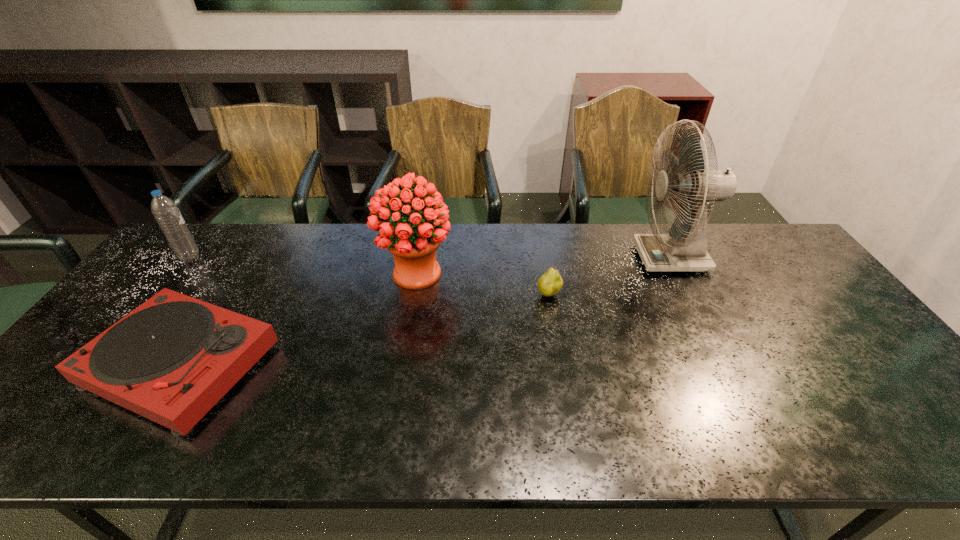
The width and height of the screenshot is (960, 540). What are the coordinates of `object situated at the far left corner` in the screenshot? It's located at (165, 211).

Locate an element on the screen. The height and width of the screenshot is (540, 960). object present at the near left corner is located at coordinates (170, 360).

Image resolution: width=960 pixels, height=540 pixels. Find the location of `free point at the far edge`. free point at the far edge is located at coordinates (526, 245).

You are a GUI agent. You are given a task and a screenshot of the screen. Output one action in this format:
    pyautogui.click(x=<x>, y=<y>)
    Task: Click on the free region at the near edge
    The width and height of the screenshot is (960, 540).
    Given the screenshot: What is the action you would take?
    [138, 440]

The height and width of the screenshot is (540, 960). In order to click on vacant space at the left edge of the desktop in this screenshot , I will do `click(112, 320)`.

Locate an element on the screen. The height and width of the screenshot is (540, 960). vacant space at the right edge is located at coordinates (826, 319).

Where is `free point at the far right corner`? free point at the far right corner is located at coordinates (756, 264).

In order to click on free region at the near right corner in this screenshot , I will do 885,446.

Identify the location of empty space between the third object from left to right and the nearest object. (299, 319).

At what (x,y) coordinates should I click in order to perform the action: click on free space between the bouquet and the water bottle. Please return your answer as a coordinate pair (x, y). The image size is (960, 540). Looking at the image, I should click on (303, 265).